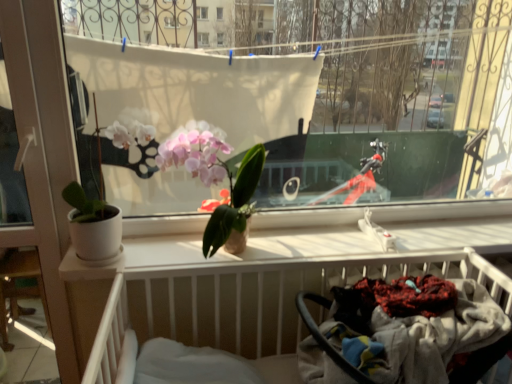
What do you see at coordinates (254, 300) in the screenshot? I see `white plastic hospital bed at lower center` at bounding box center [254, 300].

Where is `white plastic hospital bed at lower center`? white plastic hospital bed at lower center is located at coordinates (254, 300).

Locate an element on the screen. Image resolution: width=512 pixels, height=384 pixels. white plastic screen door at left is located at coordinates pyautogui.click(x=42, y=151).

How distant is black rubber baby carriage at lower right from white plastic hospital bed at lower center?

black rubber baby carriage at lower right is 9.46 inches away from white plastic hospital bed at lower center.

From a real-world perspective, does black rubber baby carriage at lower right sit lower than white plastic hospital bed at lower center?

Incorrect, from a real-world perspective, black rubber baby carriage at lower right is higher than white plastic hospital bed at lower center.

Considering the points (435, 331) and (243, 265), which point is in front, point (435, 331) or point (243, 265)?

The point (435, 331) is more forward.

Considering the relative positions of black rubber baby carriage at lower right and white plastic hospital bed at lower center in the image provided, is black rubber baby carriage at lower right behind white plastic hospital bed at lower center?

That is True.

From a real-world perspective, is pink matte orchid at center above or below black rubber baby carriage at lower right?

Clearly, from a real-world perspective, pink matte orchid at center is above black rubber baby carriage at lower right.

Considering the positions of objects pink matte orchid at center and black rubber baby carriage at lower right in the image provided, who is in front, pink matte orchid at center or black rubber baby carriage at lower right?

black rubber baby carriage at lower right.

Is pink matte orchid at center thinner than black rubber baby carriage at lower right?

Correct, the width of pink matte orchid at center is less than that of black rubber baby carriage at lower right.

Choose the correct answer: Is pink matte orchid at center inside black rubber baby carriage at lower right or outside it?

pink matte orchid at center is outside black rubber baby carriage at lower right.

From the image's perspective, is white plastic hospital bed at lower center positioned above or below pink matte orchid at center?

Based on their image positions, white plastic hospital bed at lower center is located beneath pink matte orchid at center.

From a real-world perspective, is white plastic hospital bed at lower center located beneath pink matte orchid at center?

Indeed, from a real-world perspective, white plastic hospital bed at lower center is positioned beneath pink matte orchid at center.

From the picture: Can you see white plastic hospital bed at lower center touching pink matte orchid at center?

No, white plastic hospital bed at lower center is not next to pink matte orchid at center.

Which object is wider, white plastic hospital bed at lower center or pink matte orchid at center?

white plastic hospital bed at lower center.

From a real-world perspective, is white plastic hospital bed at lower center located beneath black rubber baby carriage at lower right?

Indeed, from a real-world perspective, white plastic hospital bed at lower center is positioned beneath black rubber baby carriage at lower right.

Is the surface of white plastic hospital bed at lower center in direct contact with black rubber baby carriage at lower right?

No, white plastic hospital bed at lower center is not in contact with black rubber baby carriage at lower right.

Does point (99, 330) appear closer or farther from the camera than point (305, 346)?

Point (99, 330) is closer to the camera than point (305, 346).

Find the location of `baby carriage that appears on the right of white plastic hospital bed at lower center`. baby carriage that appears on the right of white plastic hospital bed at lower center is located at coordinates (418, 336).

Which of these two, pink matte orchid at center or white plastic screen door at left, is smaller?

Smaller between the two is white plastic screen door at left.

Between pink matte orchid at center and white plastic screen door at left, which one is positioned behind?

white plastic screen door at left is behind.

Can you confirm if pink matte orchid at center is shorter than white plastic screen door at left?

Indeed, pink matte orchid at center has a lesser height compared to white plastic screen door at left.

Can we say pink matte orchid at center lies outside white plastic screen door at left?

pink matte orchid at center is positioned outside white plastic screen door at left.

From a real-world perspective, does black rubber baby carriage at lower right sit lower than pink matte orchid at center?

Answer: Yes, from a real-world perspective, black rubber baby carriage at lower right is under pink matte orchid at center.

How many degrees apart are the facing directions of black rubber baby carriage at lower right and pink matte orchid at center?

The angular difference between black rubber baby carriage at lower right and pink matte orchid at center is 1.24 degrees.

Considering the sizes of objects black rubber baby carriage at lower right and pink matte orchid at center in the image provided, who is thinner, black rubber baby carriage at lower right or pink matte orchid at center?

With smaller width is pink matte orchid at center.

Is black rubber baby carriage at lower right behind pink matte orchid at center?

No, black rubber baby carriage at lower right is in front of pink matte orchid at center.

Between point (68, 319) and point (509, 328), which one is positioned behind?

The point (68, 319) is behind.

Choose the correct answer: Is white plastic screen door at left inside black rubber baby carriage at lower right or outside it?

white plastic screen door at left is located beyond the bounds of black rubber baby carriage at lower right.

From a real-world perspective, who is located lower, white plastic screen door at left or black rubber baby carriage at lower right?

From a 3D spatial view, black rubber baby carriage at lower right is below.

The image size is (512, 384). Identify the location of hospital bed in front of the black rubber baby carriage at lower right. (254, 300).

Find the location of a particular element. The width and height of the screenshot is (512, 384). baby carriage that is on the right side of pink matte orchid at center is located at coordinates (418, 336).

Based on their spatial positions, is white plastic hospital bed at lower center or pink matte orchid at center closer to black rubber baby carriage at lower right?

The object closer to black rubber baby carriage at lower right is white plastic hospital bed at lower center.

Based on their spatial positions, is white plastic screen door at left or white plastic hospital bed at lower center closer to pink matte orchid at center?

Among the two, white plastic hospital bed at lower center is located nearer to pink matte orchid at center.

Based on their spatial positions, is white plastic screen door at left or white plastic hospital bed at lower center further from black rubber baby carriage at lower right?

white plastic screen door at left is positioned further to the anchor black rubber baby carriage at lower right.

Estimate the real-world distances between objects in this image. Which object is further from white plastic screen door at left, black rubber baby carriage at lower right or pink matte orchid at center?

Among the two, black rubber baby carriage at lower right is located further to white plastic screen door at left.

When comparing their distances from white plastic hospital bed at lower center, does white plastic screen door at left or black rubber baby carriage at lower right seem further?

Based on the image, white plastic screen door at left appears to be further to white plastic hospital bed at lower center.

Looking at the image, which one is located closer to white plastic screen door at left, pink matte orchid at center or white plastic hospital bed at lower center?

pink matte orchid at center is positioned closer to the anchor white plastic screen door at left.

Considering their positions, is pink matte orchid at center positioned further to black rubber baby carriage at lower right than white plastic hospital bed at lower center?

pink matte orchid at center is positioned further to the anchor black rubber baby carriage at lower right.

Based on their spatial positions, is white plastic screen door at left or pink matte orchid at center further from black rubber baby carriage at lower right?

Among the two, white plastic screen door at left is located further to black rubber baby carriage at lower right.

The image size is (512, 384). I want to click on baby carriage between pink matte orchid at center and white plastic hospital bed at lower center vertically, so click(x=418, y=336).

Where is `houseplant between white plastic screen door at left and black rubber baby carriage at lower right in the horizontal direction`? Image resolution: width=512 pixels, height=384 pixels. houseplant between white plastic screen door at left and black rubber baby carriage at lower right in the horizontal direction is located at coordinates (215, 176).

Locate an element on the screen. Image resolution: width=512 pixels, height=384 pixels. houseplant located between white plastic screen door at left and white plastic hospital bed at lower center in the left-right direction is located at coordinates (215, 176).

You are a GUI agent. You are given a task and a screenshot of the screen. Output one action in this format:
    pyautogui.click(x=<x>, y=<y>)
    Task: Click on the hospital bed situated between white plastic screen door at left and black rubber baby carriage at lower right from left to right
    The width and height of the screenshot is (512, 384).
    Given the screenshot: What is the action you would take?
    pyautogui.click(x=254, y=300)